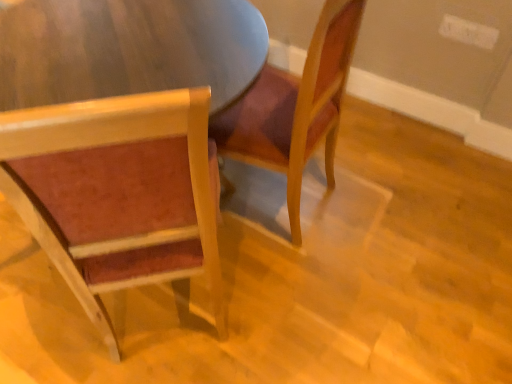
At what (x,y) coordinates should I click in order to perform the action: click on free location to the right of matte wood chair at left, acting as the 2th chair starting from the right. Please return your answer as a coordinate pair (x, y). This screenshot has height=384, width=512. Looking at the image, I should click on (292, 302).